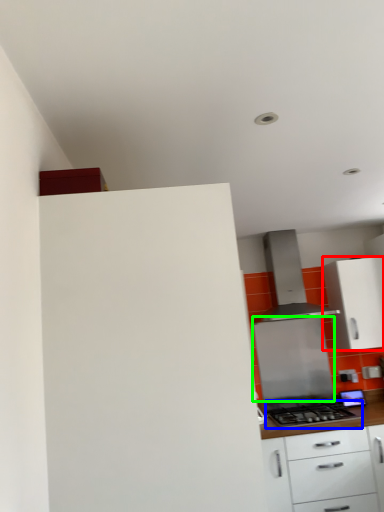
Question: Estimate the real-world distances between objects in this image. Which object is farther from cabinetry (highlighted by a red box), gas stove (highlighted by a blue box) or appliance (highlighted by a green box)?

Choices:
 (A) gas stove
 (B) appliance

Answer: (A)